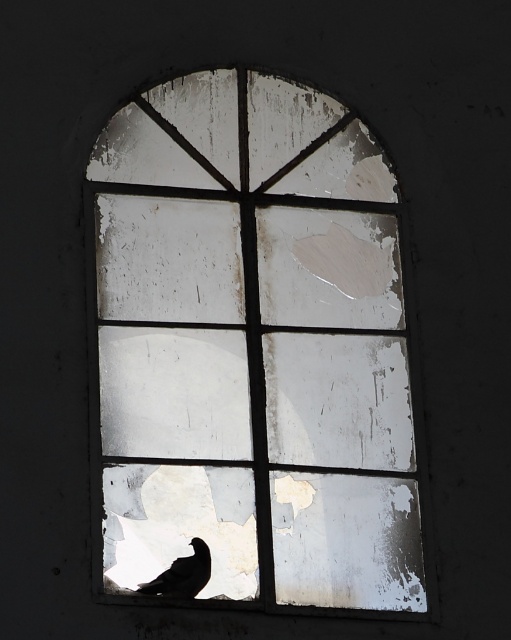
Question: Can you confirm if white peeling paint window at center is positioned to the left of silhouette feathered bird at lower left?

Choices:
 (A) yes
 (B) no

Answer: (B)

Question: Is white peeling paint window at center to the left of silhouette feathered bird at lower left from the viewer's perspective?

Choices:
 (A) yes
 (B) no

Answer: (B)

Question: Which point is closer to the camera?

Choices:
 (A) (399, 344)
 (B) (160, 584)

Answer: (B)

Question: Which point is closer to the camera?

Choices:
 (A) (332, 145)
 (B) (161, 593)

Answer: (B)

Question: Is white peeling paint window at center positioned before silhouette feathered bird at lower left?

Choices:
 (A) yes
 (B) no

Answer: (A)